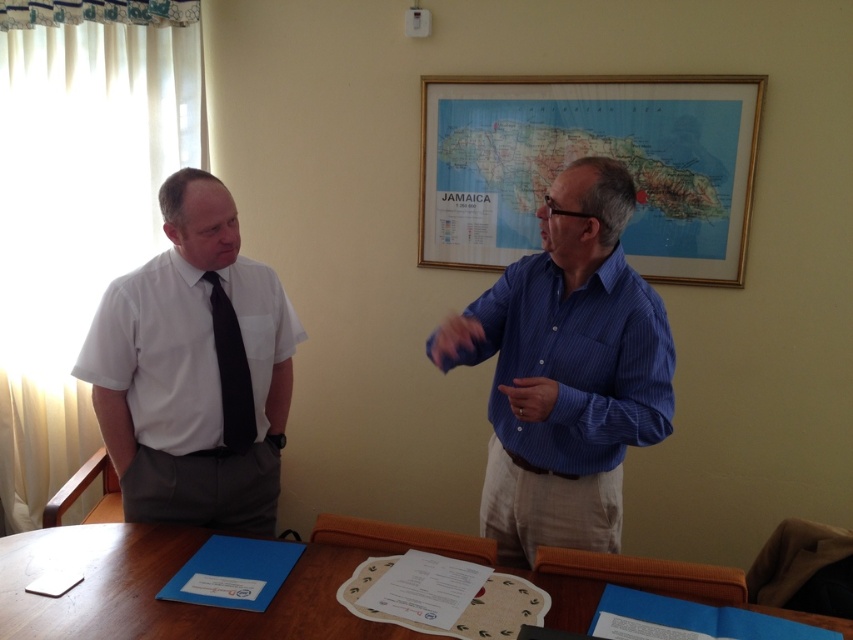
Question: Does gold-framed map at upper center appear on the left side of wooden table at lower center?

Choices:
 (A) no
 (B) yes

Answer: (A)

Question: Which of the following is the farthest from the observer?

Choices:
 (A) blue striped shirt at center
 (B) gold-framed map at upper center

Answer: (B)

Question: Does blue striped shirt at center appear on the left side of gold-framed map at upper center?

Choices:
 (A) yes
 (B) no

Answer: (A)

Question: Can you confirm if blue striped shirt at center is thinner than gold-framed map at upper center?

Choices:
 (A) yes
 (B) no

Answer: (A)

Question: Among these objects, which one is farthest from the camera?

Choices:
 (A) gold-framed map at upper center
 (B) white shirt at left
 (C) black silk tie at left

Answer: (A)

Question: Which point is farther to the camera?

Choices:
 (A) black silk tie at left
 (B) wooden table at lower center
 (C) white shirt at left

Answer: (A)